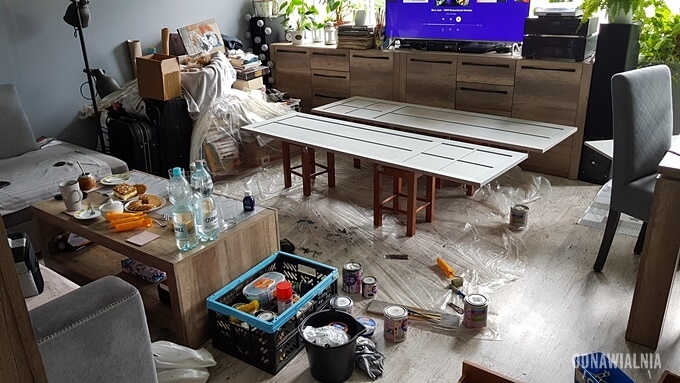
What are the coordinates of `coffee mug` in the screenshot? It's located at (67, 197).